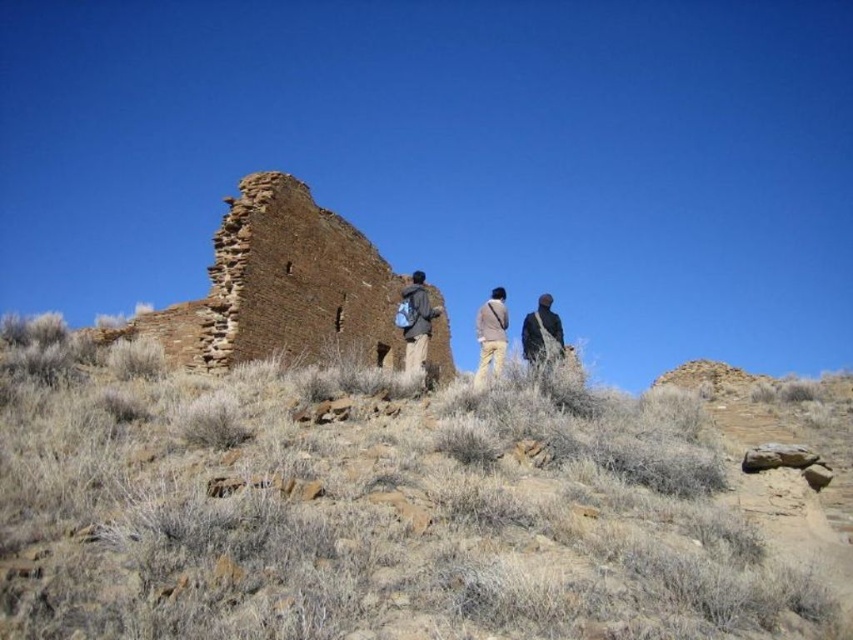
Question: Among these objects, which one is nearest to the camera?

Choices:
 (A) brown rock at center
 (B) dark brown leather jacket at center
 (C) black fabric jacket at center
 (D) khaki pants at center

Answer: (A)

Question: Does brown rock at center appear on the left side of dark brown jacket at center?

Choices:
 (A) no
 (B) yes

Answer: (B)

Question: Does dark brown jacket at center appear on the left side of black fabric jacket at center?

Choices:
 (A) no
 (B) yes

Answer: (B)

Question: Which point is closer to the camera taking this photo?

Choices:
 (A) (529, 317)
 (B) (492, 316)

Answer: (B)

Question: Estimate the real-world distances between objects in this image. Which object is farther from the dark brown leather jacket at center?

Choices:
 (A) black fabric jacket at center
 (B) khaki pants at center
 (C) brown stone ruins at center

Answer: (C)

Question: Does dark brown jacket at center have a larger size compared to khaki pants at center?

Choices:
 (A) no
 (B) yes

Answer: (B)